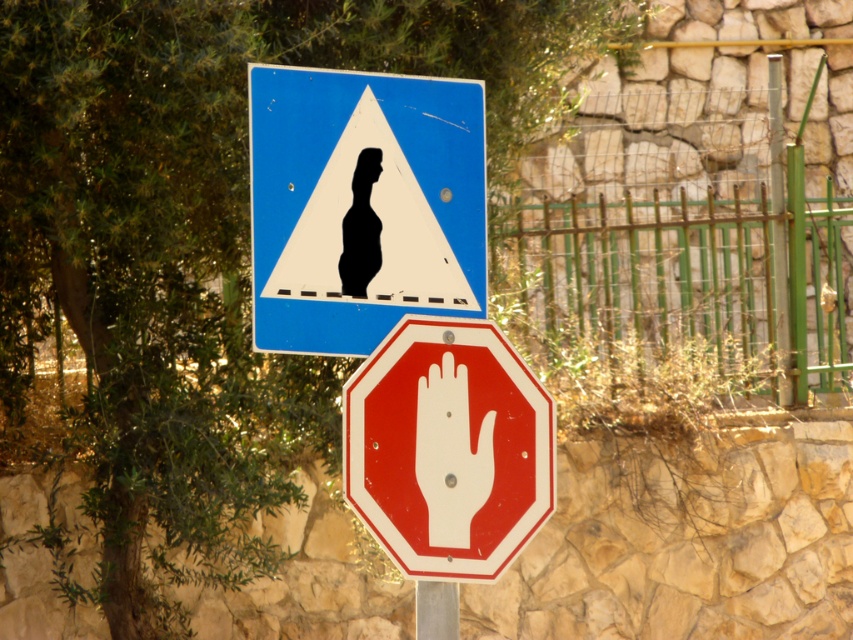
Question: Which object is positioned farthest from the green metal fence at center right?

Choices:
 (A) metallic pole at center
 (B) white matte hand at center
 (C) blue glossy triangle at upper center
 (D) red glossy octagon at center

Answer: (A)

Question: Does blue glossy triangle at upper center have a greater width compared to white matte hand at center?

Choices:
 (A) yes
 (B) no

Answer: (A)

Question: Which object is farther from the camera taking this photo?

Choices:
 (A) red glossy octagon at center
 (B) white matte hand at center
 (C) green metal fence at center right
 (D) metallic pole at center

Answer: (C)

Question: From the image, what is the correct spatial relationship of green metal fence at center right in relation to red glossy octagon at center?

Choices:
 (A) left
 (B) right

Answer: (B)

Question: Which point appears closest to the camera in this image?

Choices:
 (A) 759,276
 (B) 425,630
 (C) 437,467

Answer: (C)

Question: Considering the relative positions of green metal fence at center right and metallic pole at center in the image provided, where is green metal fence at center right located with respect to metallic pole at center?

Choices:
 (A) right
 (B) left

Answer: (A)